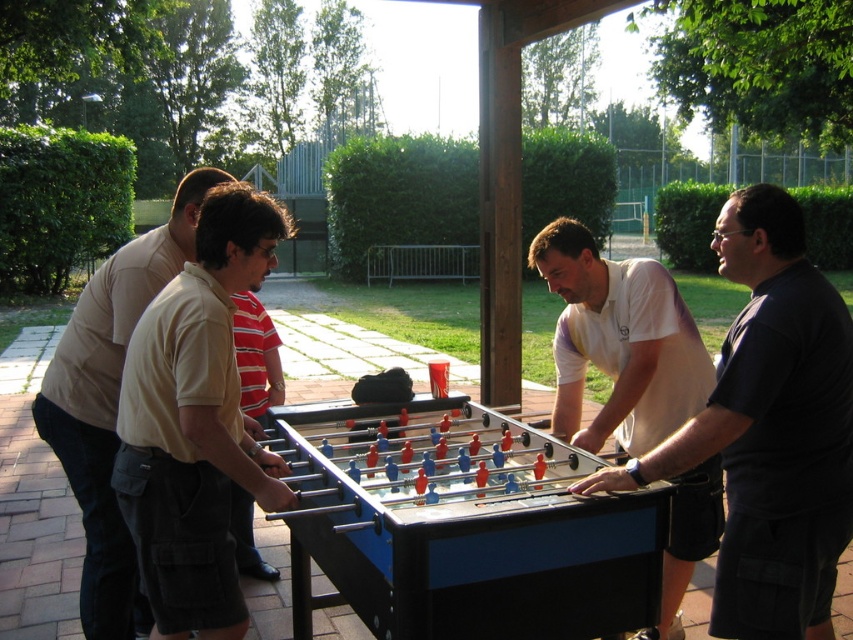
Does point (737, 326) come farther from viewer compared to point (695, 515)?

No.

Is dark blue shirt at right taller than white matte shirt at center?

No, dark blue shirt at right is not taller than white matte shirt at center.

You are a GUI agent. You are given a task and a screenshot of the screen. Output one action in this format:
    pyautogui.click(x=<x>, y=<y>)
    Task: Click on the dark blue shirt at right
    This screenshot has width=853, height=640.
    Given the screenshot: What is the action you would take?
    pyautogui.click(x=770, y=429)

Can you confirm if dark blue shirt at right is smaller than beige cotton shirt at left?

No, dark blue shirt at right is not smaller than beige cotton shirt at left.

Locate an element on the screen. dark blue shirt at right is located at coordinates (770, 429).

What do you see at coordinates (770, 429) in the screenshot? Image resolution: width=853 pixels, height=640 pixels. I see `dark blue shirt at right` at bounding box center [770, 429].

Locate an element on the screen. Image resolution: width=853 pixels, height=640 pixels. dark blue shirt at right is located at coordinates (770, 429).

This screenshot has height=640, width=853. What do you see at coordinates (619, 342) in the screenshot? I see `white matte shirt at center` at bounding box center [619, 342].

From the picture: Which of these two, white matte shirt at center or beige cotton shirt at left, stands shorter?

white matte shirt at center

The width and height of the screenshot is (853, 640). In order to click on white matte shirt at center in this screenshot , I will do `click(619, 342)`.